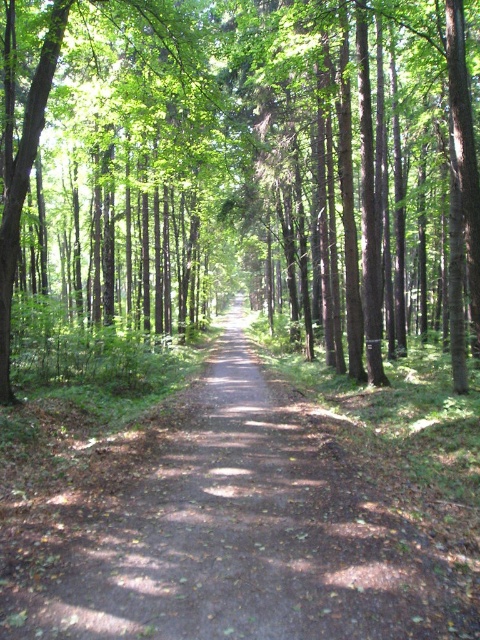
You are a hiker walking along the dirt path at center. You want to take a photo of the green leafy tree at center. Which side of the path should you stand on to get the best view of the tree?

The green leafy tree at center is positioned on the right side of the dirt path at center. To get the best view of the tree, you should stand on the left side of the dirt path at center so that the tree is clearly visible without obstruction from the path itself.